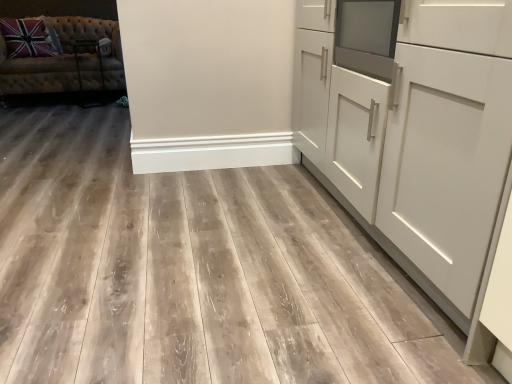
Question: Is tufted fabric studio couch at upper left at the back of white matte cabinet at right?

Choices:
 (A) no
 (B) yes

Answer: (A)

Question: From a real-world perspective, is white matte cabinet at right on tufted fabric studio couch at upper left?

Choices:
 (A) yes
 (B) no

Answer: (A)

Question: Considering the relative sizes of white matte cabinet at right and tufted fabric studio couch at upper left in the image provided, is white matte cabinet at right thinner than tufted fabric studio couch at upper left?

Choices:
 (A) yes
 (B) no

Answer: (A)

Question: Could you tell me if white matte cabinet at right is turned towards tufted fabric studio couch at upper left?

Choices:
 (A) yes
 (B) no

Answer: (B)

Question: From the image's perspective, is white matte cabinet at right on tufted fabric studio couch at upper left?

Choices:
 (A) yes
 (B) no

Answer: (B)

Question: Is there a large distance between white matte cabinet at right and tufted fabric studio couch at upper left?

Choices:
 (A) no
 (B) yes

Answer: (B)

Question: Can you confirm if tufted fabric studio couch at upper left is wider than white matte cabinet at right?

Choices:
 (A) yes
 (B) no

Answer: (A)

Question: Are tufted fabric studio couch at upper left and white matte cabinet at right far apart?

Choices:
 (A) no
 (B) yes

Answer: (B)

Question: Is white matte cabinet at right at the back of tufted fabric studio couch at upper left?

Choices:
 (A) yes
 (B) no

Answer: (B)

Question: Are tufted fabric studio couch at upper left and white matte cabinet at right making contact?

Choices:
 (A) no
 (B) yes

Answer: (A)

Question: Does tufted fabric studio couch at upper left have a lesser width compared to white matte cabinet at right?

Choices:
 (A) no
 (B) yes

Answer: (A)

Question: Is tufted fabric studio couch at upper left at the left side of white matte cabinet at right?

Choices:
 (A) no
 (B) yes

Answer: (B)

Question: Is tufted fabric studio couch at upper left wider or thinner than white matte cabinet at right?

Choices:
 (A) wide
 (B) thin

Answer: (A)